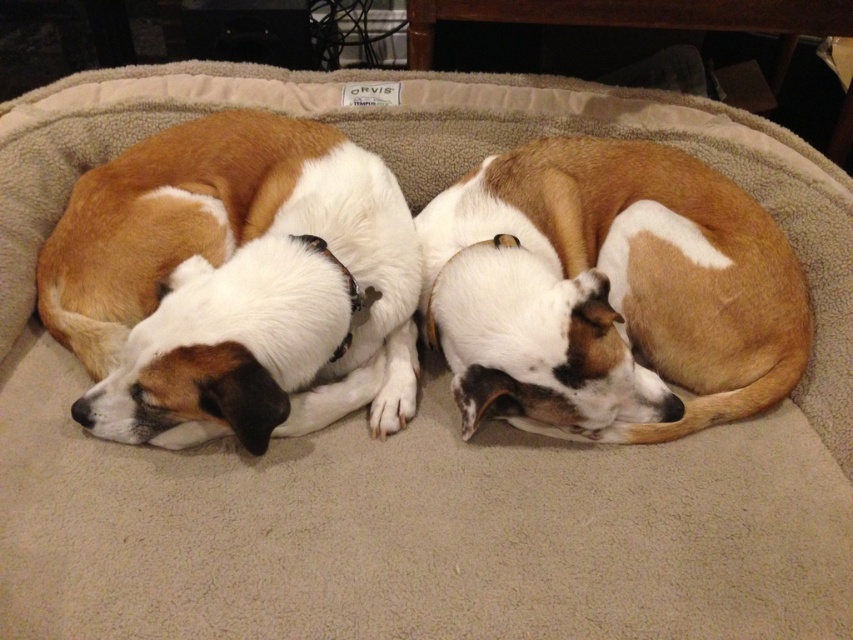
In the scene shown: You are a photographer trying to capture a closeup of the two dogs on the ORVIS dog bed. You notice two specific points of interest marked as point 1 at coordinates point (x=317, y=132) and point 2 at coordinates point (x=463, y=285). Which point should you focus on first to ensure both dogs are in sharp focus?

Point 1 at coordinates point (x=317, y=132) should be focused on first because it is closer to the viewer than point 2 at coordinates point (x=463, y=285). By focusing on the closer point, the depth of field will naturally include the farther point in the composition.